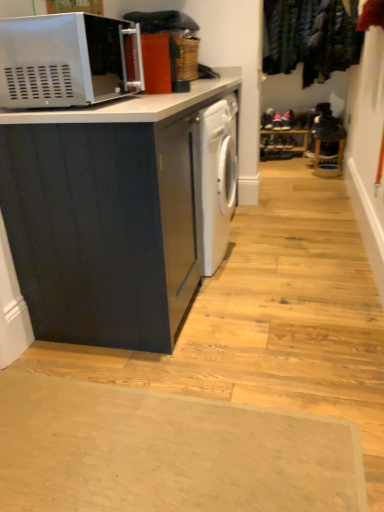
Question: From the image's perspective, is velvet green coat at upper right positioned above or below matte black cabinet at left?

Choices:
 (A) below
 (B) above

Answer: (B)

Question: Based on their sizes in the image, would you say velvet green coat at upper right is bigger or smaller than matte black cabinet at left?

Choices:
 (A) big
 (B) small

Answer: (B)

Question: Which object is the closest to the matte black cabinet at left?

Choices:
 (A) velvet green coat at upper right
 (B) beige rubber doormat at lower center
 (C) satin silver microwave at upper left

Answer: (C)

Question: Estimate the real-world distances between objects in this image. Which object is closer to the satin silver microwave at upper left?

Choices:
 (A) matte black cabinet at left
 (B) velvet green coat at upper right
 (C) beige rubber doormat at lower center

Answer: (A)